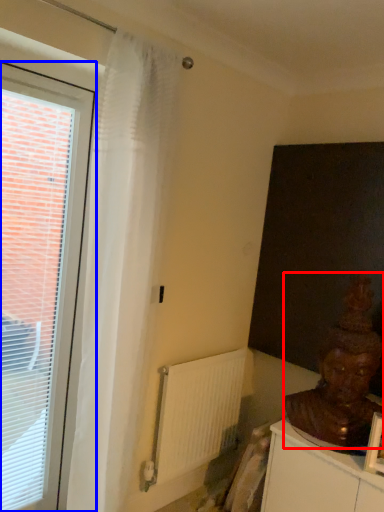
Question: Which object appears farthest to the camera in this image, person (highlighted by a red box) or window (highlighted by a blue box)?

Choices:
 (A) person
 (B) window

Answer: (A)